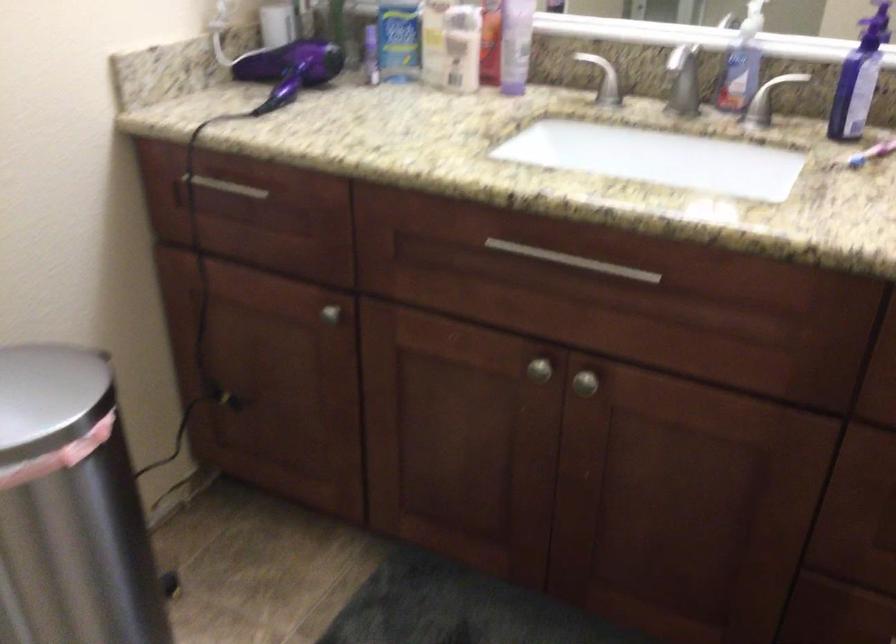
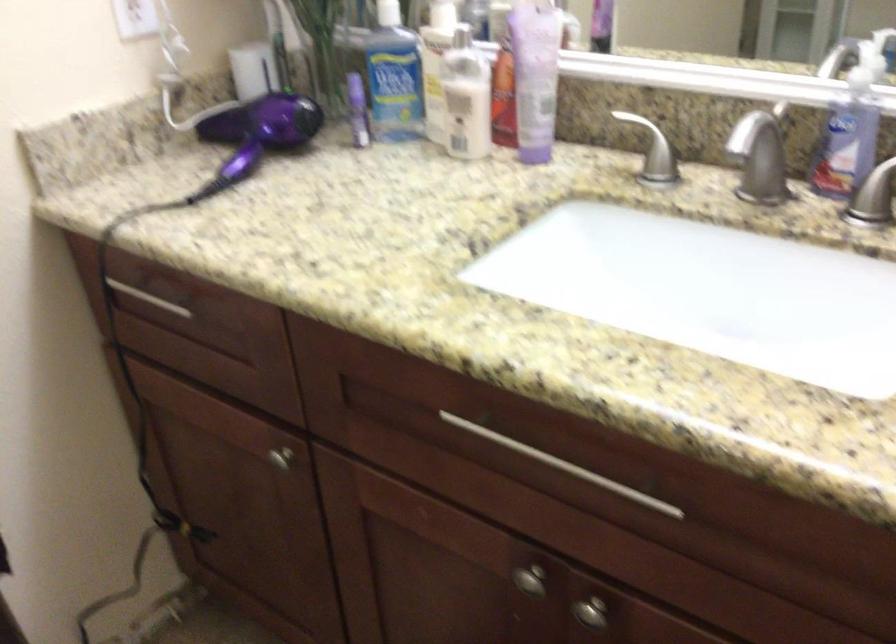
The point at (591,383) is marked in the first image. Where is the corresponding point in the second image?

(590, 612)